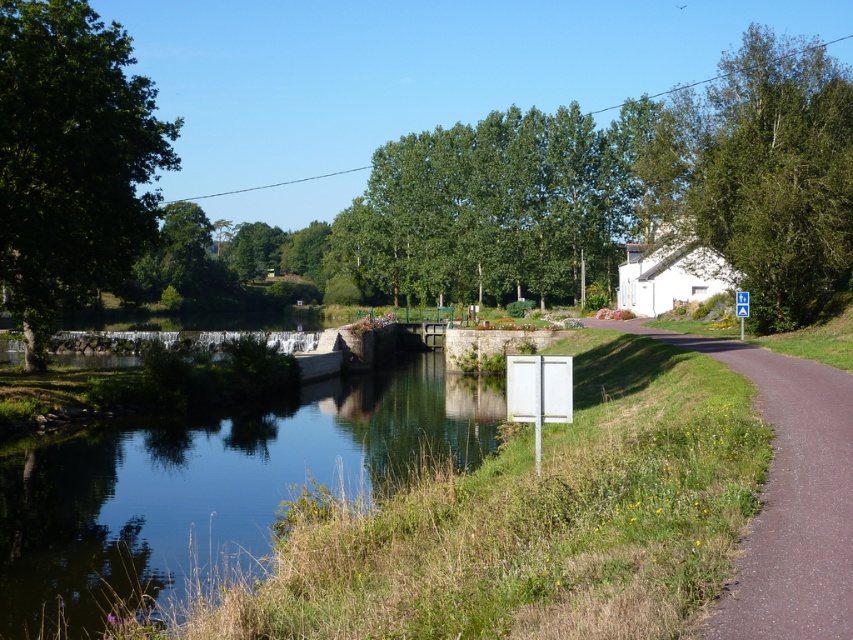
From the picture: You are a photographer planning to capture the reflection of the clear water at center and the white plastic sign at center in the image. Based on their positions, which object will have a larger reflection in the water?

The clear water at center has a greater height compared to the white plastic sign at center, so its reflection in the water will be larger.

You are planning to install a bench along the brown asphalt path at lower right for visitors to enjoy the view of the green leafy tree at upper right. Considering the distance between them, what is the approximate distance visitors will have to walk from the bench to reach the base of the tree?

The green leafy tree at upper right and brown asphalt path at lower right are 150.12 feet apart from each other. Therefore, visitors would need to walk approximately 150 feet to reach the base of the green leafy tree at upper right from the bench on the brown asphalt path at lower right.